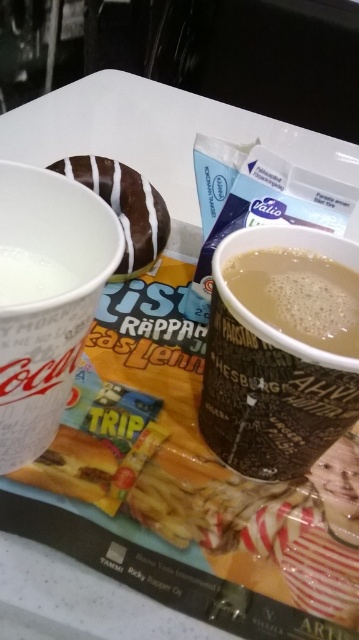
Is brown paper cup at center thinner than white glossy donut at center?

Yes, brown paper cup at center is thinner than white glossy donut at center.

Between brown paper cup at center and white glossy donut at center, which one has less height?

white glossy donut at center is shorter.

Who is more distant from viewer, (x=216, y=330) or (x=132, y=182)?

Positioned behind is point (x=132, y=182).

Locate an element on the screen. brown paper cup at center is located at coordinates (272, 372).

Can you confirm if white paper cup at left is bigger than brown matte cup at center?

Indeed, white paper cup at left has a larger size compared to brown matte cup at center.

Can you confirm if white paper cup at left is smaller than brown matte cup at center?

Incorrect, white paper cup at left is not smaller in size than brown matte cup at center.

Find the location of `white paper cup at left`. white paper cup at left is located at coordinates (45, 298).

Does brown paper cup at center have a smaller size compared to brown matte cup at center?

Incorrect, brown paper cup at center is not smaller in size than brown matte cup at center.

Who is higher up, brown paper cup at center or brown matte cup at center?

Positioned higher is brown matte cup at center.

Who is more forward, (216, 260) or (231, 280)?

Point (216, 260)

Find the location of `brown paper cup at center`. brown paper cup at center is located at coordinates (272, 372).